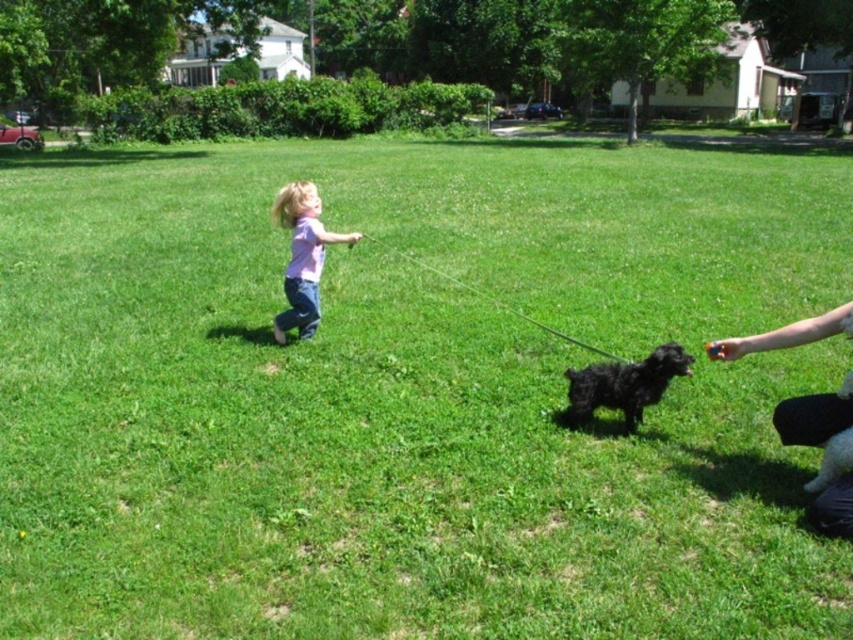
Question: Which of the following is the farthest from the observer?

Choices:
 (A) (598, 376)
 (B) (310, 244)

Answer: (B)

Question: Does pink cotton shirt at center have a smaller size compared to black fuzzy dog at center?

Choices:
 (A) yes
 (B) no

Answer: (B)

Question: Among these objects, which one is farthest from the camera?

Choices:
 (A) black fuzzy dog at center
 (B) pink cotton shirt at center

Answer: (B)

Question: Does pink cotton shirt at center have a smaller size compared to black fuzzy dog at center?

Choices:
 (A) no
 (B) yes

Answer: (A)

Question: From the image, what is the correct spatial relationship of pink cotton shirt at center in relation to black fuzzy dog at center?

Choices:
 (A) above
 (B) below

Answer: (A)

Question: Which of the following is the farthest from the observer?

Choices:
 (A) (283, 205)
 (B) (614, 388)

Answer: (A)